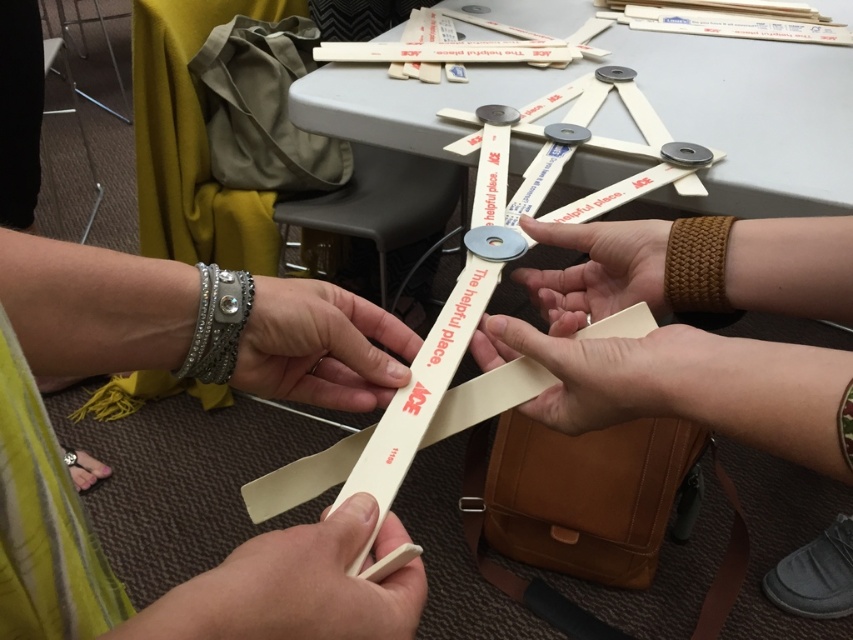
Question: Is beige matte/soft hand at lower center closer to camera compared to beige matte strip at center?

Choices:
 (A) no
 (B) yes

Answer: (B)

Question: Based on their relative distances, which object is farther from the brown woven bracelet at center?

Choices:
 (A) silver metallic bracelet at lower left
 (B) white plastic ruler at center
 (C) matte silver tape at center

Answer: (A)

Question: Considering the relative positions of beige leather bag at lower center and matte silver tape at center in the image provided, where is beige leather bag at lower center located with respect to matte silver tape at center?

Choices:
 (A) below
 (B) above

Answer: (A)

Question: Which point is farther to the camera?

Choices:
 (A) beige matte/soft hand at lower center
 (B) white plastic ruler at center
 (C) matte white strap at center

Answer: (C)

Question: Is beige matte/soft hand at lower center wider than white plastic ruler at center?

Choices:
 (A) yes
 (B) no

Answer: (B)

Question: Which object is the closest to the silver metallic bracelet at lower left?

Choices:
 (A) matte white strap at center
 (B) beige leather bag at lower center
 (C) brown woven bracelet at center
 (D) beige matte strip at center

Answer: (D)